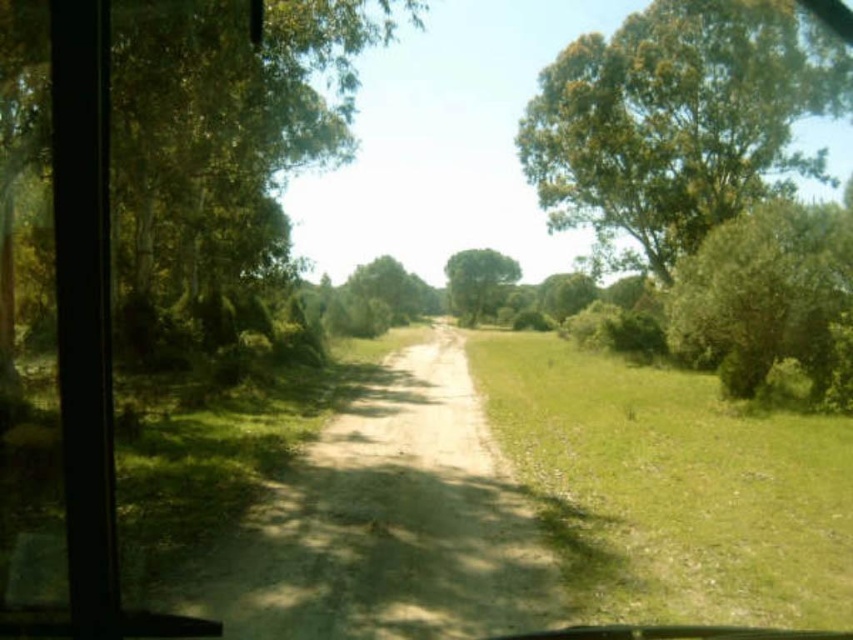
Question: Does green grass at center appear on the left side of dusty brown dirt track at center?

Choices:
 (A) no
 (B) yes

Answer: (A)

Question: Which point is farther to the camera?

Choices:
 (A) (352, 429)
 (B) (804, 612)
 (C) (509, 257)
 (D) (0, 112)

Answer: (C)

Question: Is green leafy tree at left below green leafy tree at center?

Choices:
 (A) no
 (B) yes

Answer: (B)

Question: Which object is farther from the camera taking this photo?

Choices:
 (A) green leafy tree at left
 (B) dusty brown dirt track at center
 (C) green grass at center

Answer: (A)

Question: Which object appears closest to the camera in this image?

Choices:
 (A) green leafy tree at left
 (B) green grass at center
 (C) green leafy tree at center

Answer: (B)

Question: Can you confirm if green leafy tree at upper right is positioned above green leafy tree at center?

Choices:
 (A) no
 (B) yes

Answer: (B)